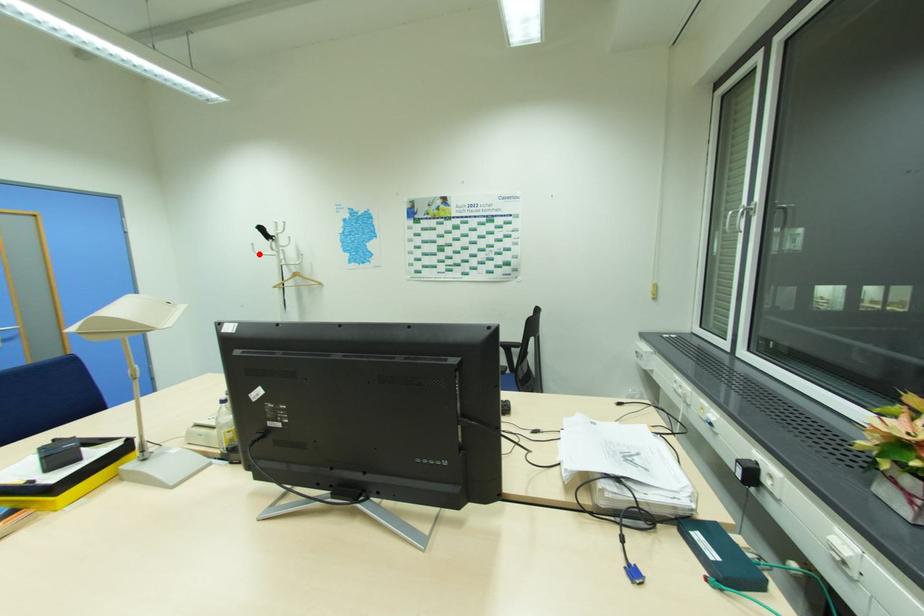
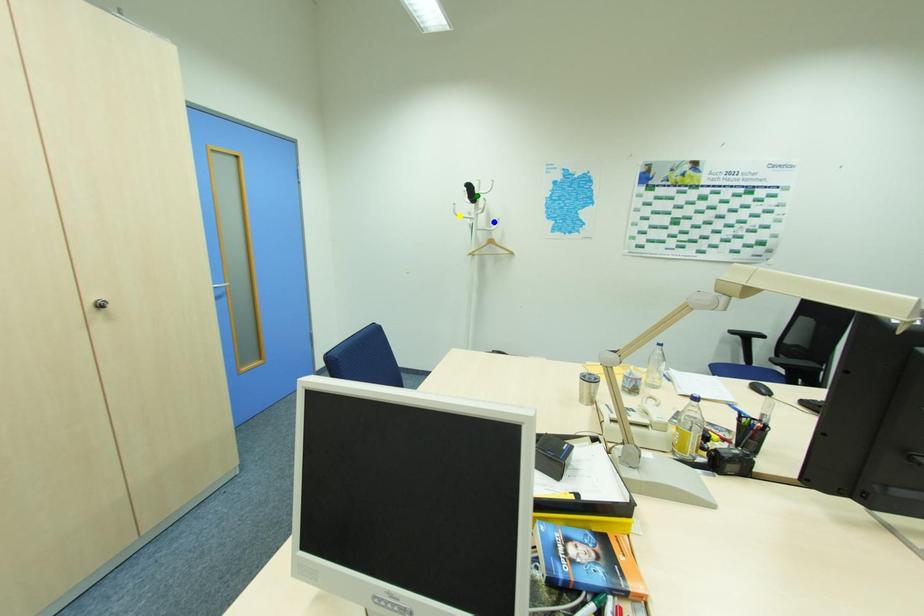
Question: I am providing you with two images of the same scene from different viewpoints. A red point is marked on the first image. You are given multiple points on the second image. Which mark in image 2 goes with the point in image 1?

Choices:
 (A) yellow point
 (B) green point
 (C) blue point

Answer: (A)